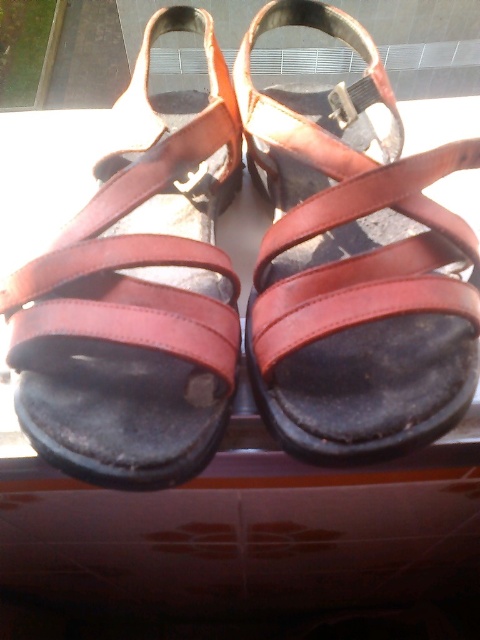
Question: Which object appears closest to the camera in this image?

Choices:
 (A) brown leather sandals at center
 (B) brown leather sandal at center
 (C) leather sandals at center

Answer: (C)

Question: Does leather sandals at center have a smaller size compared to brown leather sandals at center?

Choices:
 (A) yes
 (B) no

Answer: (B)

Question: Which point appears farthest from the camera in this image?

Choices:
 (A) (168, 241)
 (B) (425, 262)

Answer: (A)

Question: Can you confirm if leather sandals at center is positioned below brown leather sandals at center?

Choices:
 (A) yes
 (B) no

Answer: (A)

Question: Which point is farther from the camera taking this photo?

Choices:
 (A) (183, 458)
 (B) (280, 385)
 (C) (447, 132)

Answer: (C)

Question: Can you confirm if brown leather sandal at center is positioned below leather sandals at center?

Choices:
 (A) no
 (B) yes

Answer: (A)